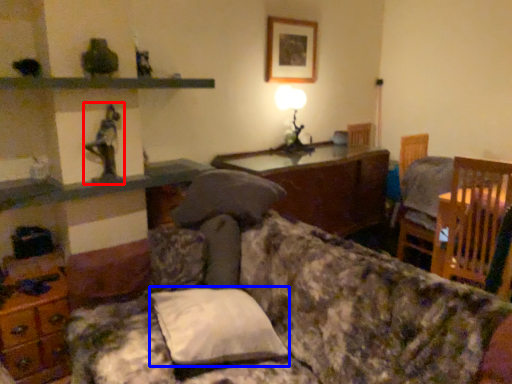
Question: Among these objects, which one is nearest to the camera, toy (highlighted by a red box) or pillow (highlighted by a blue box)?

Choices:
 (A) toy
 (B) pillow

Answer: (B)